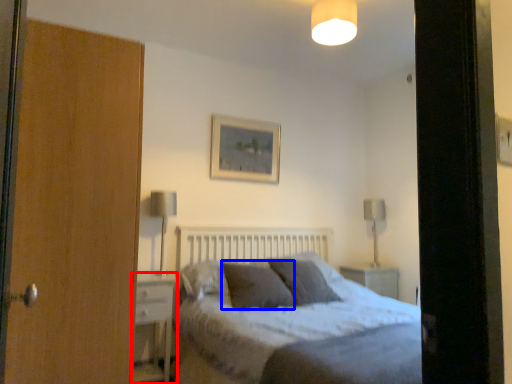
Question: Which of the following is the closest to the observer, nightstand (highlighted by a red box) or pillow (highlighted by a blue box)?

Choices:
 (A) nightstand
 (B) pillow

Answer: (A)